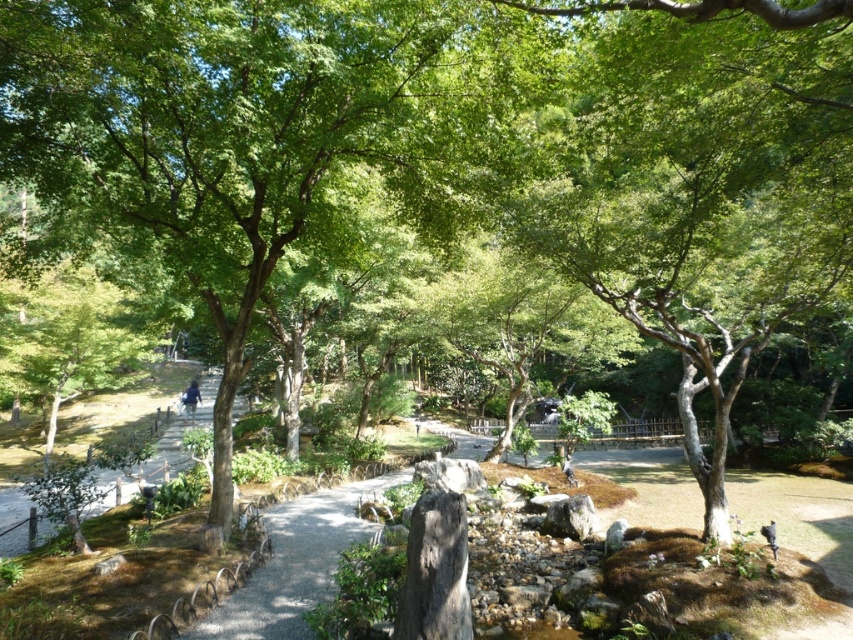
You are a gardener planning to place a decorative stone at the exact center of the garden. The gravel path at center is located at coordinate point 0.880, 0.348. If the garden is represented on a coordinate grid where the bottom left corner is 0,0 and the top right corner is 1,1, where should you place the decorative stone?

The exact center of the garden would be at coordinate point (426, 320). Since the gravel path at center is at (296, 563), the decorative stone should be placed closer to the bottom left corner to reach the true center at (426, 320).

Consider the image. You are standing at the entrance of the garden and want to reach the central water feature. According to the image, where exactly is the gravel pathway at lower left located in terms of coordinates?

The gravel pathway at lower left is located at coordinates point (143, 413).

You are a photographer planning to take a photo of the blue fabric person at lower center and the dark brown wooden person at center in the garden. You want to ensure both subjects are in focus. Considering their heights, which subject should you focus on first to maximize the depth of field?

The blue fabric person at lower center is taller than the dark brown wooden person at center. To maximize depth of field, focus on the taller subject first, which is the blue fabric person at lower center.